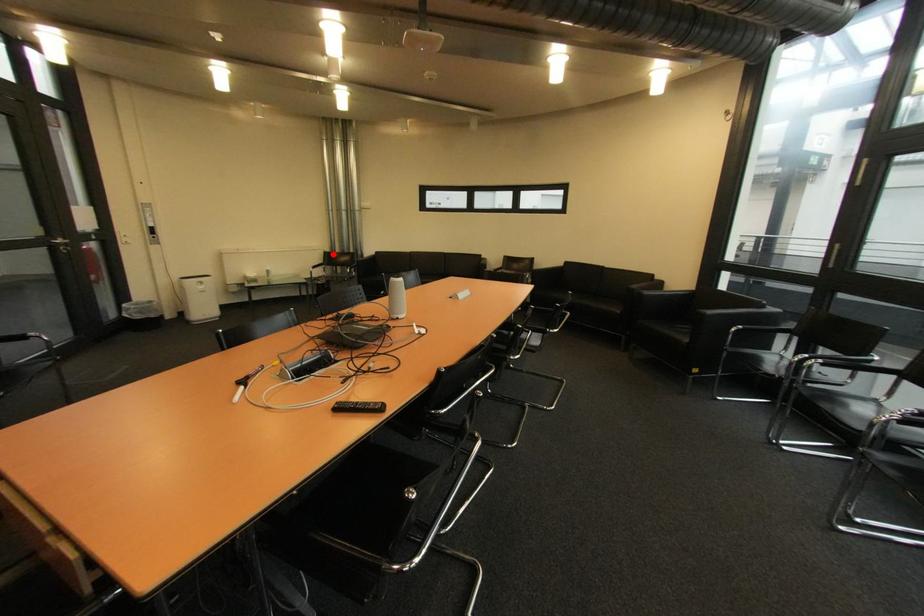
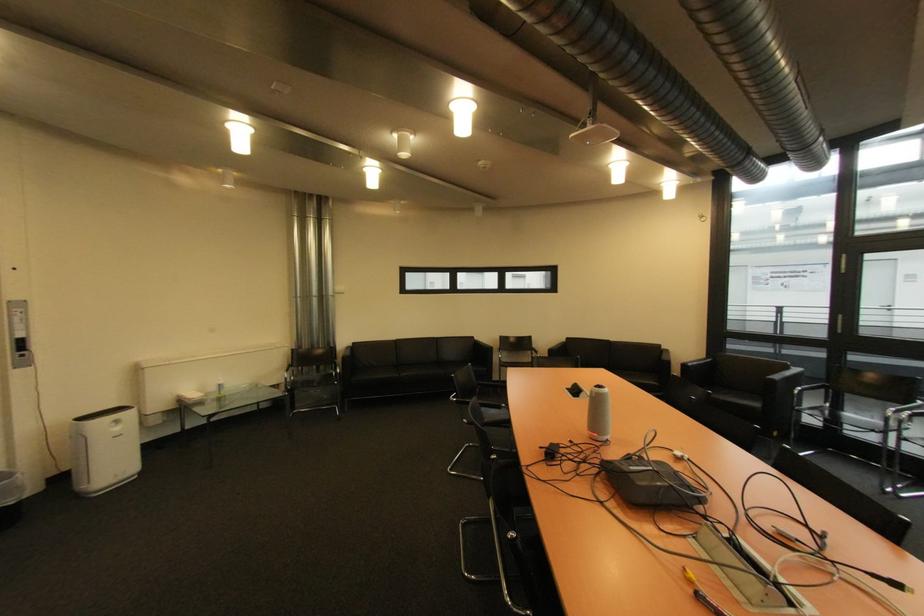
Question: I am providing you with two images of the same scene from different viewpoints. In image1, a red point is highlighted. Considering the same 3D point in image2, which of the following is correct?

Choices:
 (A) It is closer
 (B) It is farther

Answer: (B)